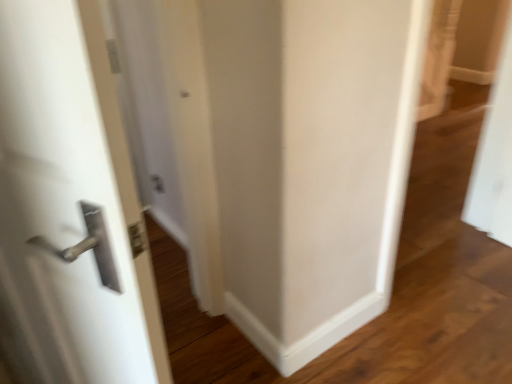
The image size is (512, 384). What do you see at coordinates (69, 207) in the screenshot? I see `white glossy door handle at left` at bounding box center [69, 207].

What is the approximate height of white glossy door handle at left?

3.56 feet.

Where is `white glossy door handle at left`? This screenshot has height=384, width=512. white glossy door handle at left is located at coordinates click(x=69, y=207).

Where is `white glossy door handle at left`? white glossy door handle at left is located at coordinates (69, 207).